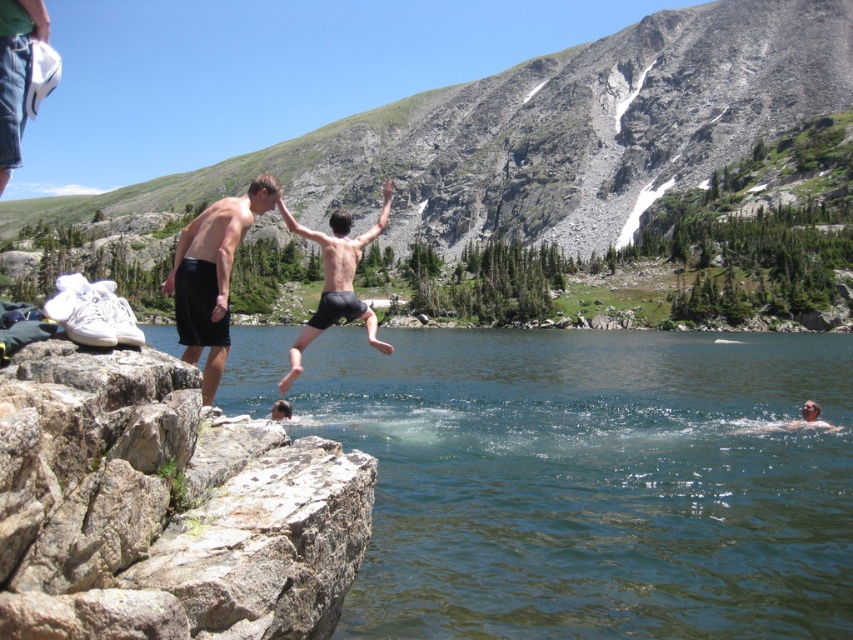
Which is in front, point (508, 444) or point (328, 253)?

Point (328, 253)

Locate an element on the screen. The image size is (853, 640). clear water at cliff edge is located at coordinates (592, 481).

Does black matte shorts at left appear over black matte shorts at center?

Incorrect, black matte shorts at left is not positioned above black matte shorts at center.

Is black matte shorts at left to the left of black matte shorts at center from the viewer's perspective?

Correct, you'll find black matte shorts at left to the left of black matte shorts at center.

Is point (256, 211) farther from viewer compared to point (335, 300)?

No, it is not.

What are the coordinates of `black matte shorts at left` in the screenshot? It's located at (212, 275).

Between point (300, 618) and point (352, 292), which one is positioned in front?

Positioned in front is point (300, 618).

Does rough textured rock at left lie in front of black matte shorts at center?

Yes, rough textured rock at left is closer to the viewer.

You are a GUI agent. You are given a task and a screenshot of the screen. Output one action in this format:
    pyautogui.click(x=<x>, y=<y>)
    Task: Click on the rough textured rock at left
    The height and width of the screenshot is (640, 853).
    Given the screenshot: What is the action you would take?
    pyautogui.click(x=164, y=508)